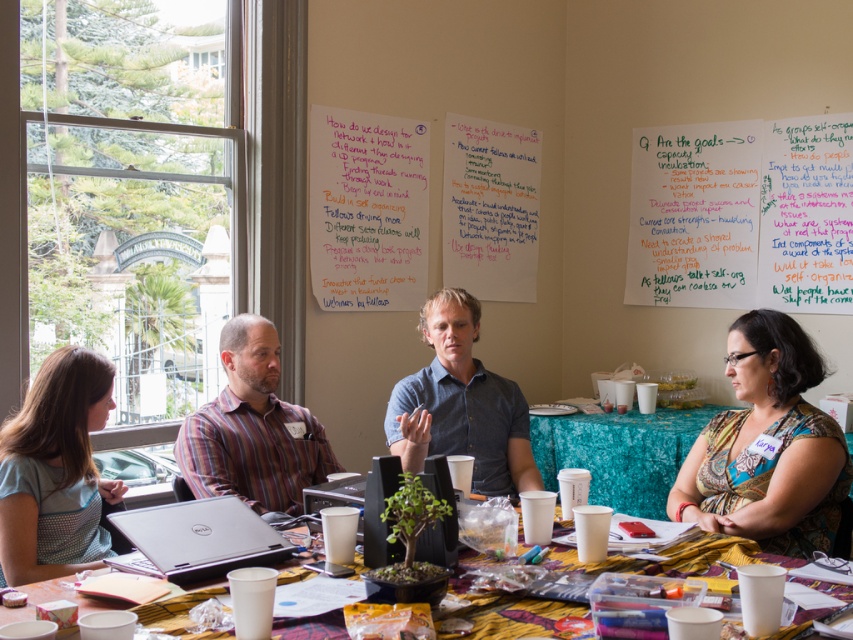
Question: Which object appears farthest from the camera in this image?

Choices:
 (A) wooden table at center
 (B) light blue cotton shirt at lower left
 (C) teal fabric table at center
 (D) white paper at upper right

Answer: (D)

Question: Which point appears closest to the camera in this image?

Choices:
 (A) coord(659,477)
 (B) coord(738,486)
 (C) coord(64,355)

Answer: (C)

Question: Which object is the farthest from the blue denim shirt at center?

Choices:
 (A) teal fabric table at center
 (B) light blue cotton shirt at lower left
 (C) patterned fabric shirt at lower right

Answer: (B)

Question: Is white paper at upper right above light blue cotton shirt at lower left?

Choices:
 (A) no
 (B) yes

Answer: (B)

Question: Does plaid shirt at center appear over blue denim shirt at center?

Choices:
 (A) no
 (B) yes

Answer: (A)

Question: Can you confirm if white paper at upper right is wider than light blue cotton shirt at lower left?

Choices:
 (A) yes
 (B) no

Answer: (A)